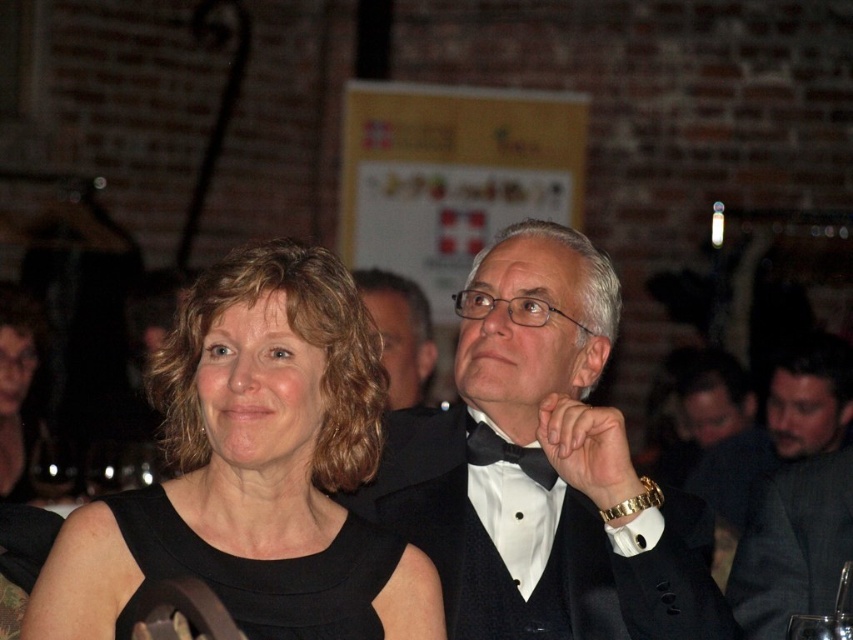
Is black satin tuxedo at center positioned in front of dark gray suit at right?

That is True.

This screenshot has height=640, width=853. Describe the element at coordinates (549, 461) in the screenshot. I see `black satin tuxedo at center` at that location.

You are a GUI agent. You are given a task and a screenshot of the screen. Output one action in this format:
    pyautogui.click(x=<x>, y=<y>)
    Task: Click on the black satin tuxedo at center
    
    Given the screenshot: What is the action you would take?
    pyautogui.click(x=549, y=461)

Which of these two, black satin dress at center or black satin bow tie at center, stands shorter?

black satin bow tie at center

Who is positioned more to the right, black satin dress at center or black satin bow tie at center?

Positioned to the right is black satin bow tie at center.

Between point (184, 534) and point (494, 440), which one is positioned behind?

The point (494, 440) is more distant.

Image resolution: width=853 pixels, height=640 pixels. I want to click on black satin dress at center, so click(x=265, y=572).

Does black satin tuxedo at center have a greater height compared to black satin bow tie at center?

Indeed, black satin tuxedo at center has a greater height compared to black satin bow tie at center.

Looking at this image, which of these two, black satin tuxedo at center or black satin bow tie at center, stands shorter?

Standing shorter between the two is black satin bow tie at center.

Who is more distant from viewer, (515, 316) or (486, 440)?

Positioned behind is point (486, 440).

At what (x,y) coordinates should I click in order to perform the action: click on black satin tuxedo at center. Please return your answer as a coordinate pair (x, y). The width and height of the screenshot is (853, 640). Looking at the image, I should click on (549, 461).